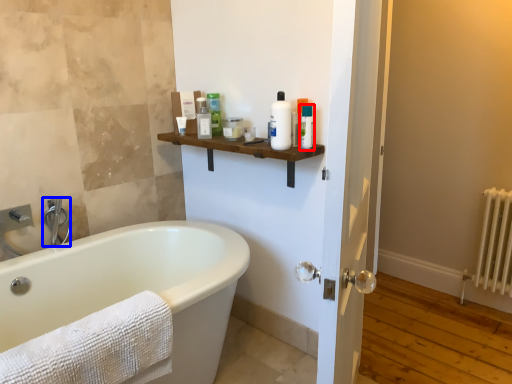
Question: Among these objects, which one is nearest to the camera, toiletry (highlighted by a red box) or faucet (highlighted by a blue box)?

Choices:
 (A) toiletry
 (B) faucet

Answer: (A)